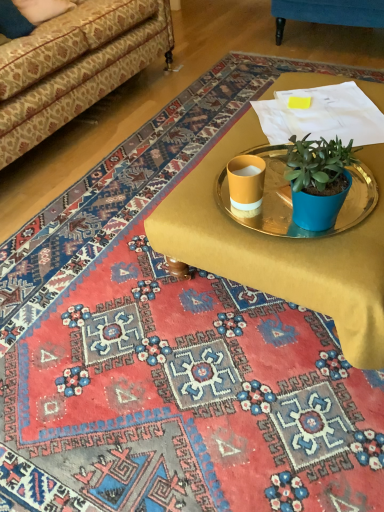
This screenshot has height=512, width=384. In order to click on blank space to the left of matte yellow cup at center in this screenshot , I will do (193, 218).